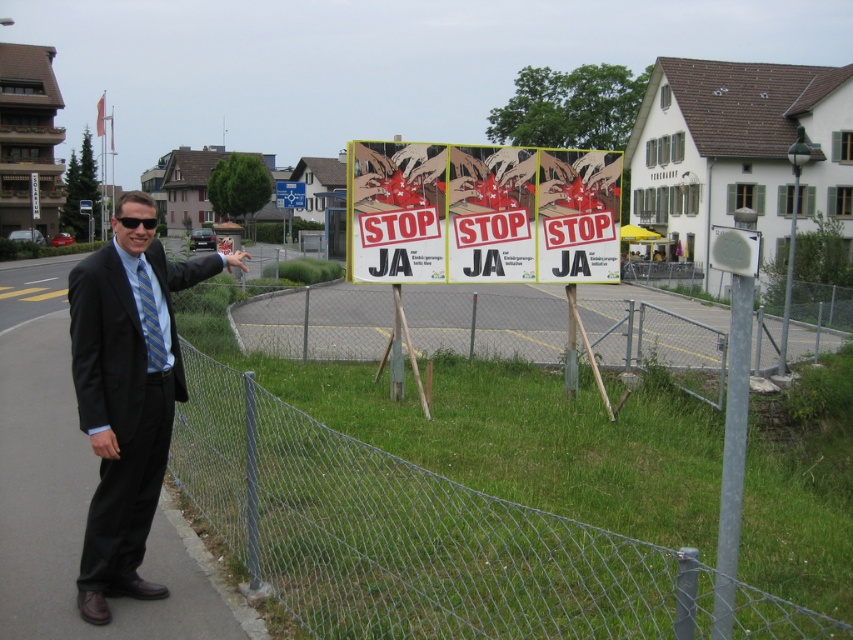
You are a delivery person trying to locate the address. You see the wire mesh fence at lower left and the black suit at left. Which object is closer to the road?

The black suit at left is closer to the road because the wire mesh fence at lower left is positioned to its right side, meaning the suit is nearer to the road direction.

You are a photographer planning to take a group photo of the man in the black suit at left and the wire mesh fence at lower left. Since you want both subjects to appear equally prominent in the photo, which subject should you position closer to the camera?

You should position the wire mesh fence at lower left closer to the camera because its width surpasses that of the black suit at left, so moving it nearer will help balance their prominence in the photo.